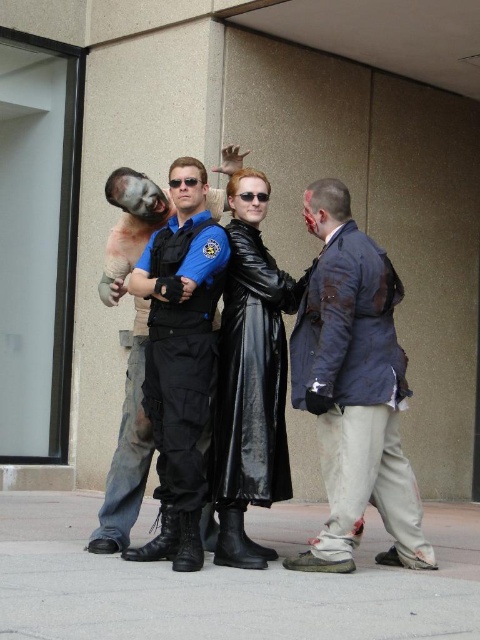
You are a photographer at the event and want to capture a photo where the matte black uniform at center is visible above the black matte sunglasses at center. Is this possible given their current positions?

The matte black uniform at center is located below the black matte sunglasses at center, so it is not possible to have the matte black uniform at center visible above the black matte sunglasses at center in their current positions.

You are a photographer at the event. You want to take a photo that includes both the dark blue suit at right and the sunglasses at center. Which object should you adjust to ensure both are fully visible in the frame?

Since the dark blue suit at right is in front of the sunglasses at center, you should move the sunglasses at center slightly backward to ensure both are fully visible in the frame.

Consider the image. You are a photographer adjusting your camera settings to focus on the matte black uniform at center and the black matte sunglasses at center. Which object should you focus on first to ensure proper depth of field?

The matte black uniform at center is closer to the viewer than the black matte sunglasses at center, so focus on the matte black uniform at center first to ensure proper depth of field.